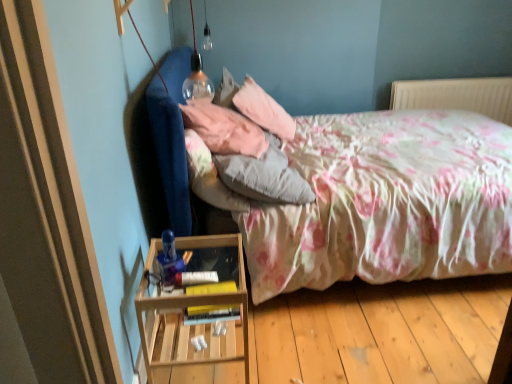
Question: Do you think wooden at left is within white plastic radiator at upper right, or outside of it?

Choices:
 (A) outside
 (B) inside

Answer: (A)

Question: Does point (168, 301) appear closer or farther from the camera than point (411, 104)?

Choices:
 (A) closer
 (B) farther

Answer: (A)

Question: Estimate the real-world distances between objects in this image. Which object is farther from the pink soft pillow at upper center, the 3th pillow in the front-to-back sequence?

Choices:
 (A) floral fabric bed at center
 (B) white plastic radiator at upper right
 (C) pink fabric pillow at upper center, the 2th pillow in the back-to-front sequence
 (D) wooden at left
 (E) fluffy white pillow at center, which is the first pillow in front-to-back order

Answer: (B)

Question: Which of these objects is positioned farthest from the white plastic radiator at upper right?

Choices:
 (A) fluffy white pillow at center, which ranks as the 3th pillow in back-to-front order
 (B) pink soft pillow at upper center, placed as the first pillow when sorted from back to front
 (C) floral fabric bed at center
 (D) wooden at left
 (E) pink fabric pillow at upper center, the 2th pillow in the back-to-front sequence

Answer: (D)